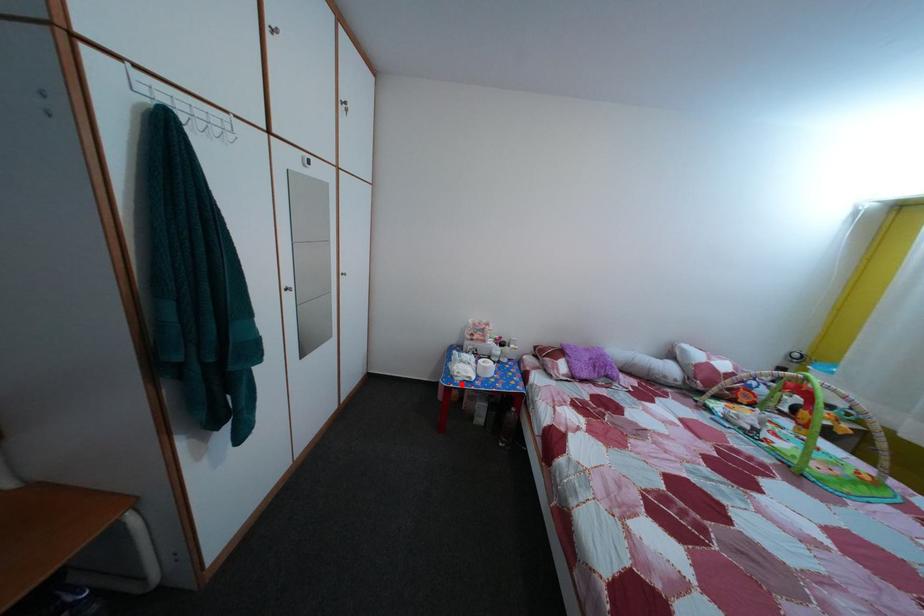
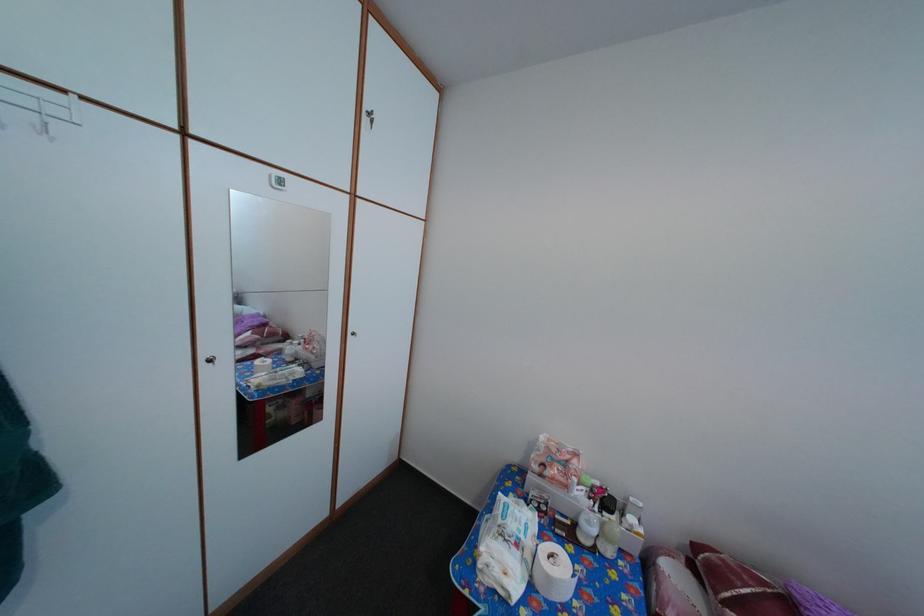
Locate, in the second image, the point that corresponds to the highlighted location in the first image.

(484, 572)